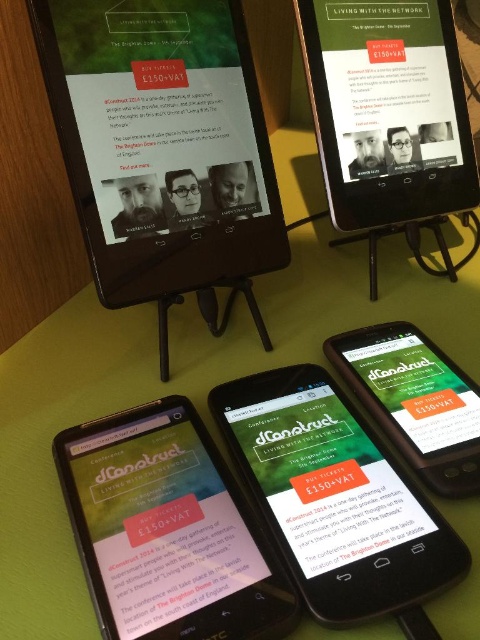
Is matte green phone at center positioned in front of matte black tablet at upper center?

Yes, it is.

Does matte green phone at center have a lesser height compared to matte black tablet at upper center?

Yes, matte green phone at center is shorter than matte black tablet at upper center.

Where is `matte green phone at center`? The height and width of the screenshot is (640, 480). matte green phone at center is located at coordinates (168, 531).

Can you confirm if matte black tablet at upper center is positioned to the right of green matte smartphone at center?

Incorrect, matte black tablet at upper center is not on the right side of green matte smartphone at center.

Between matte black tablet at upper center and green matte smartphone at center, which one has less height?

Standing shorter between the two is green matte smartphone at center.

Identify the location of matte black tablet at upper center. (336, 499).

Is matte green phone at center taller than green matte smartphone at center?

No, matte green phone at center is not taller than green matte smartphone at center.

Based on the photo, who is more distant from viewer, (181, 476) or (361, 397)?

The point (361, 397) is behind.

This screenshot has width=480, height=640. I want to click on matte green phone at center, so click(168, 531).